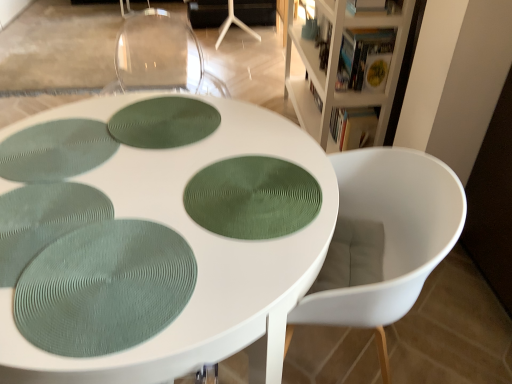
Identify the location of free spot above green textured placemat at lower left, which is the first oval from front to back (from a real-world perspective). This screenshot has height=384, width=512. (111, 278).